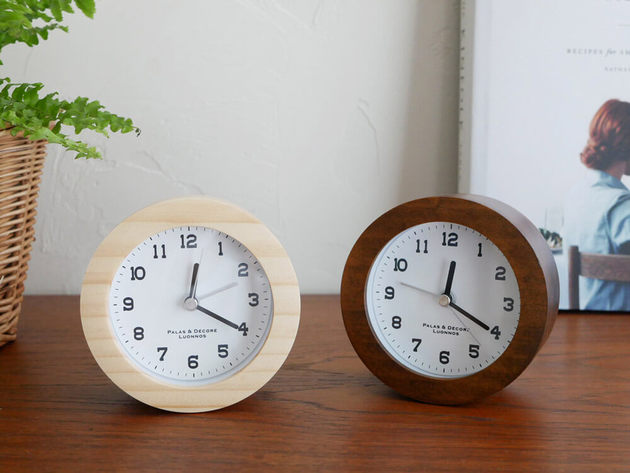
Where is `clock`? The image size is (630, 473). clock is located at coordinates (184, 213), (457, 210).